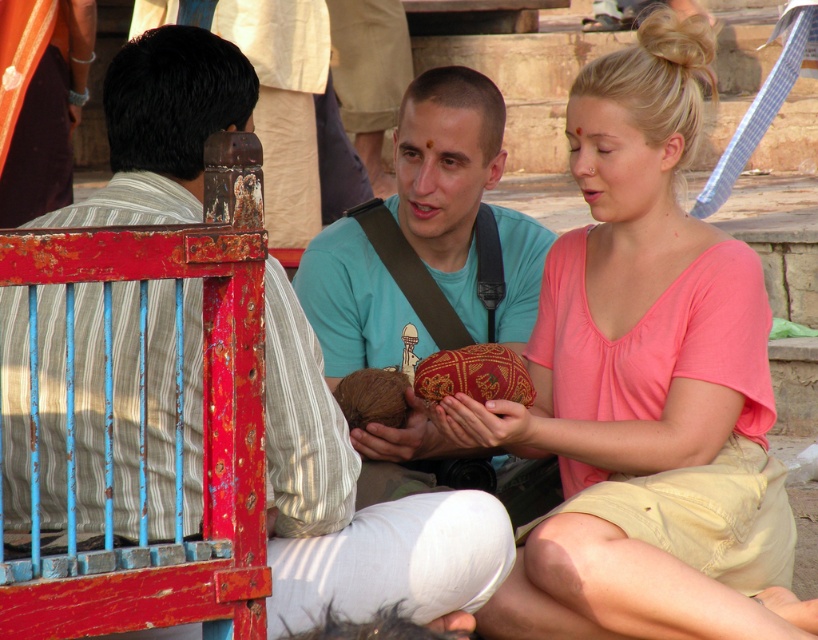
Question: Does pink matte shirt at center have a larger size compared to matte brown coconut at center?

Choices:
 (A) no
 (B) yes

Answer: (A)

Question: Considering the real-world distances, which object is farthest from the matte teal shirt at center?

Choices:
 (A) matte brown coconut at center
 (B) pink matte shirt at center

Answer: (A)

Question: Which point is farther to the camera?

Choices:
 (A) (126, 49)
 (B) (645, 348)
 (C) (452, 84)

Answer: (C)

Question: Which of the following is the farthest from the observer?

Choices:
 (A) (495, 144)
 (B) (64, 502)

Answer: (A)

Question: Is matte brown coconut at center smaller than matte teal shirt at center?

Choices:
 (A) no
 (B) yes

Answer: (A)

Question: Can you confirm if matte brown coconut at center is wider than matte teal shirt at center?

Choices:
 (A) no
 (B) yes

Answer: (B)